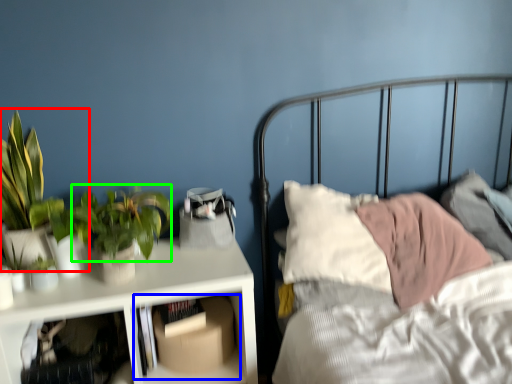
Question: Which object is the closest to the houseplant (highlighted by a red box)? Choose among these: shelf (highlighted by a blue box) or vegetation (highlighted by a green box).

Choices:
 (A) shelf
 (B) vegetation

Answer: (B)